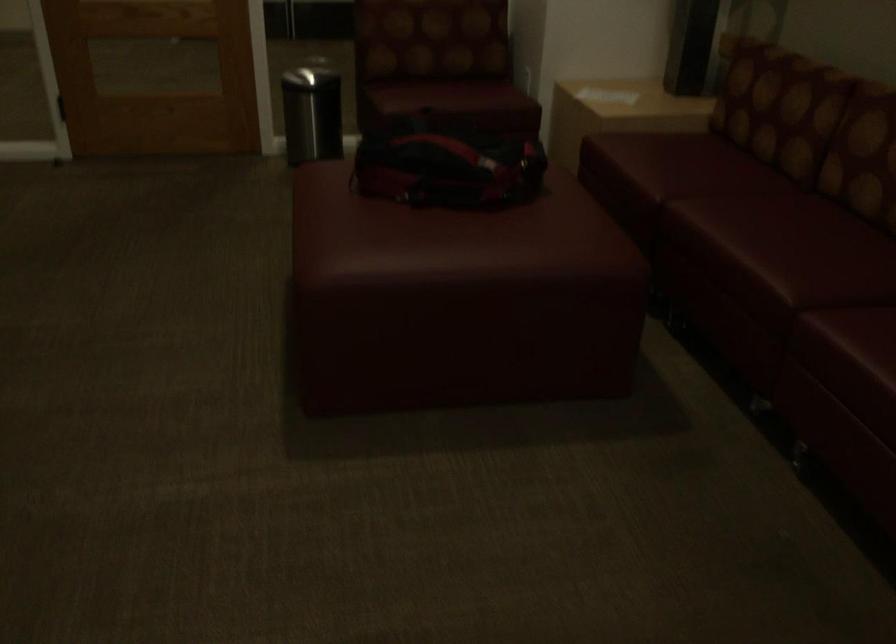
Find where to lift the red bag strap. Please return your answer as a coordinate pair (x, y).

(517, 267)